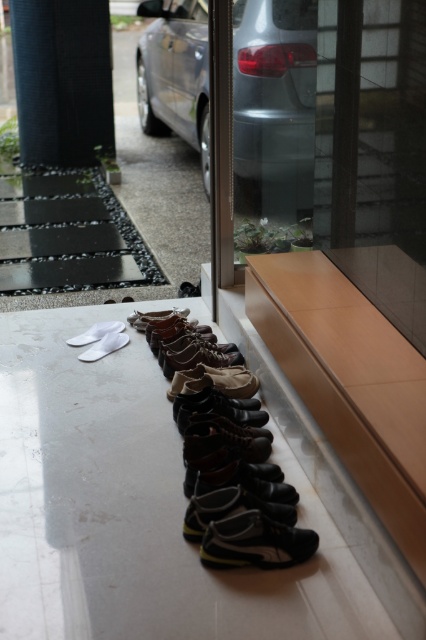
You are a delivery person who needs to place a package between the black leather shoes at center and the white suede slipper at lower left. The package is 36 inches long. Will there be enough space to fit the package between them?

The black leather shoes at center and the white suede slipper at lower left are 35.91 inches apart from each other. Since the package is 36 inches long, which is slightly longer than the available space, the package will not fit between them.